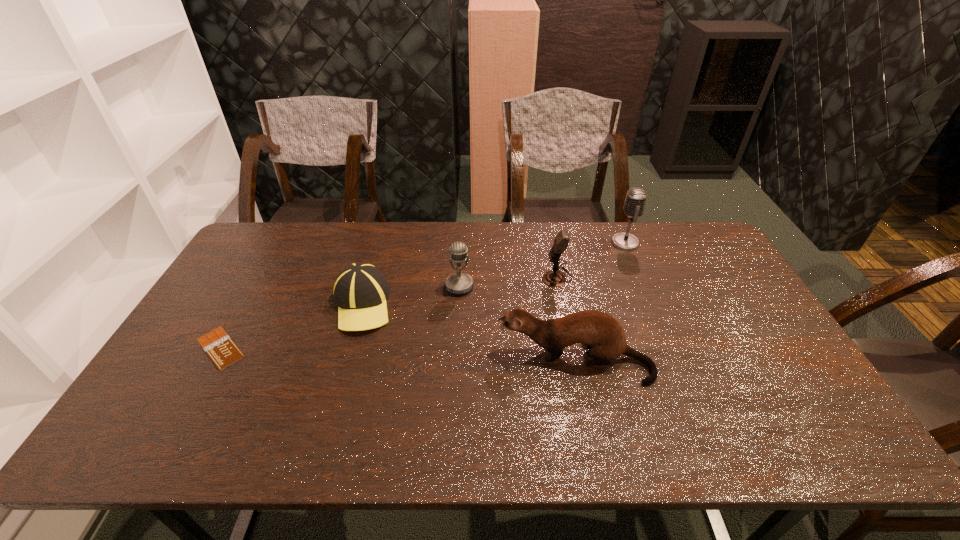
The width and height of the screenshot is (960, 540). Find the location of `blank space located 0.300m on the front-facing side of the second microphone from left to right`. blank space located 0.300m on the front-facing side of the second microphone from left to right is located at coordinates click(x=449, y=277).

Identify the location of vacant point located on the front-facing side of the second microphone from left to right. (470, 277).

I want to click on vacant space situated on the front-facing side of the second microphone from left to right, so click(x=492, y=277).

Identify the location of vacant space situated 0.080m on the front-facing side of the leftmost microphone. The height and width of the screenshot is (540, 960). (458, 315).

The width and height of the screenshot is (960, 540). Find the location of `free space located 0.290m at the face of the ferret`. free space located 0.290m at the face of the ferret is located at coordinates (388, 361).

Where is `free spot located at the face of the ferret`? The image size is (960, 540). free spot located at the face of the ferret is located at coordinates (399, 361).

Where is `vacant area situated 0.270m at the face of the ferret`? This screenshot has height=540, width=960. vacant area situated 0.270m at the face of the ferret is located at coordinates (396, 361).

Locate an element on the screen. free region located with the brim of the baseball cap facing forward is located at coordinates (323, 443).

Image resolution: width=960 pixels, height=540 pixels. In order to click on vacant area situated 0.060m on the back of the shortest object in this screenshot , I will do `click(241, 312)`.

This screenshot has height=540, width=960. In order to click on object that is at the far edge in this screenshot , I will do `click(636, 198)`.